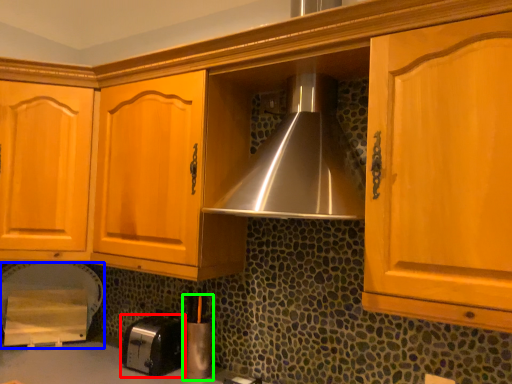
Question: Estimate the real-world distances between objects in this image. Which object is closer to toaster (highlighted by a red box), appliance (highlighted by a blue box) or appliance (highlighted by a green box)?

Choices:
 (A) appliance
 (B) appliance

Answer: (B)